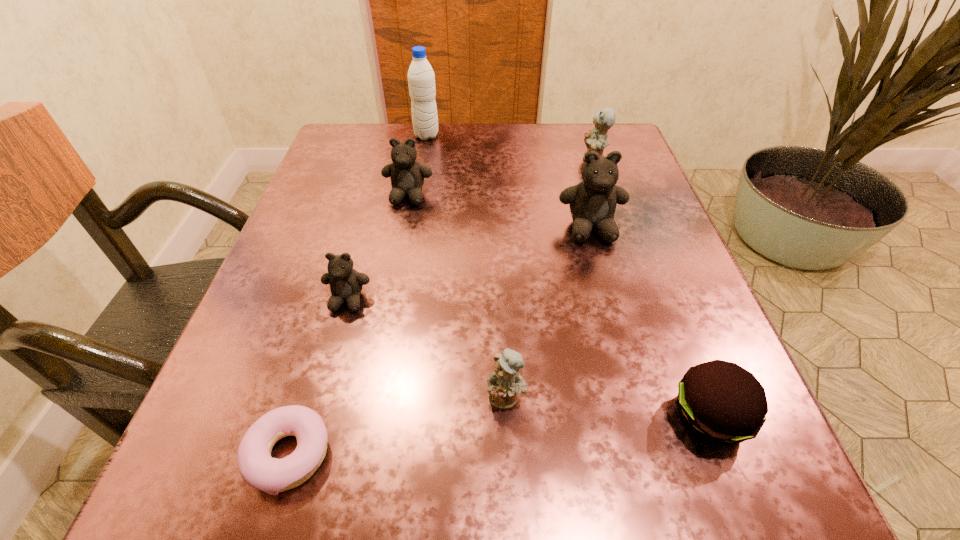
This screenshot has width=960, height=540. I want to click on the tallest object, so click(x=421, y=79).

Where is `water bottle`? This screenshot has height=540, width=960. water bottle is located at coordinates (421, 79).

Find the location of `the second tallest object`. the second tallest object is located at coordinates (592, 202).

The image size is (960, 540). What are the coordinates of `the biggest brown teddy bear` in the screenshot? It's located at (592, 202).

Identify the location of the farthest teddy bear. This screenshot has width=960, height=540. (596, 140).

Image resolution: width=960 pixels, height=540 pixels. I want to click on the right blue teddy bear, so click(x=596, y=140).

Locate an element on the screen. The height and width of the screenshot is (540, 960). the farthest brown teddy bear is located at coordinates (407, 175).

Find the location of a particular element. the third farthest object is located at coordinates pos(407,175).

At what (x,y) coordinates should I click in order to perform the action: click on the second nearest teddy bear. Please return your answer as a coordinate pair (x, y). The height and width of the screenshot is (540, 960). Looking at the image, I should click on (346, 284).

Locate an element on the screen. the nearest brown teddy bear is located at coordinates (346, 284).